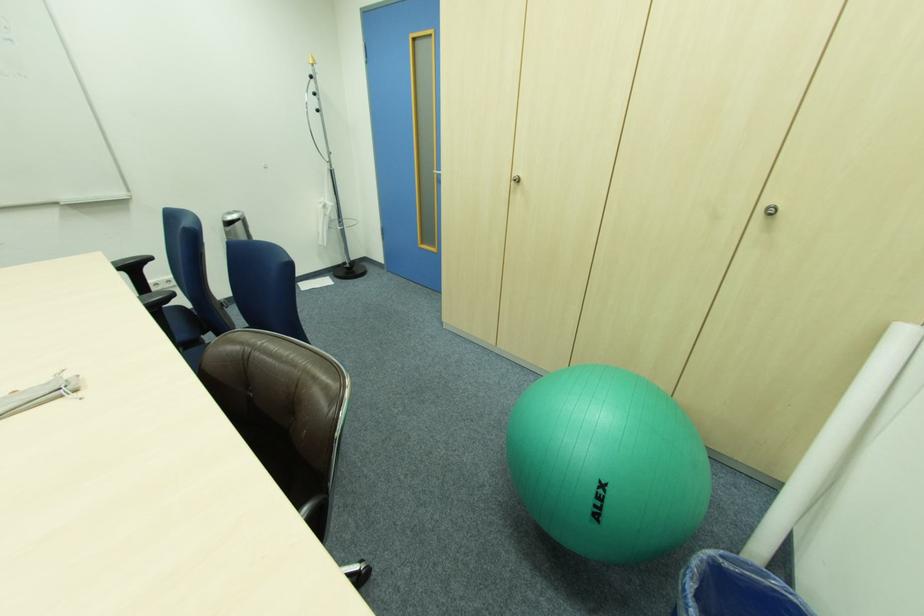
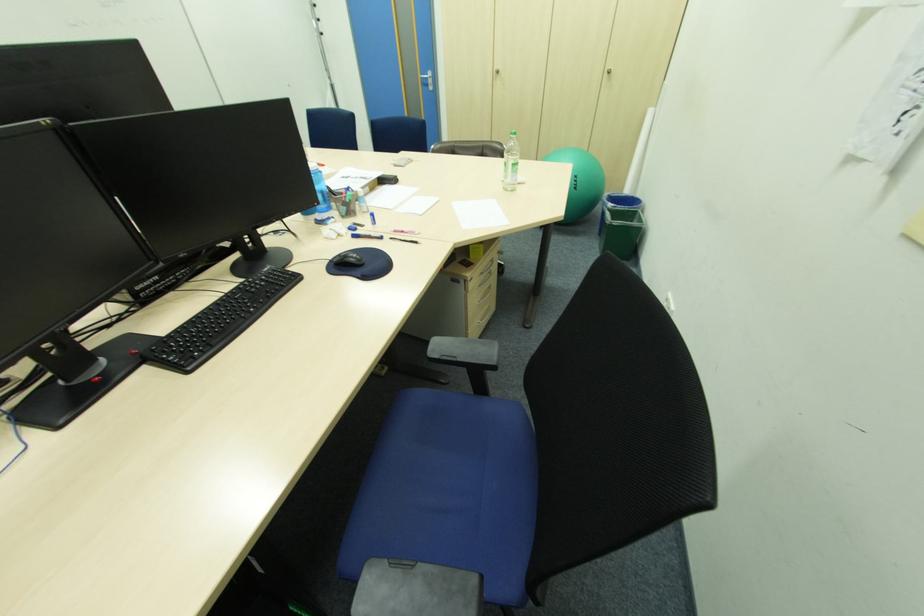
The images are taken continuously from a first-person perspective. In which direction are you moving?

The cameraman walked toward left, backward.